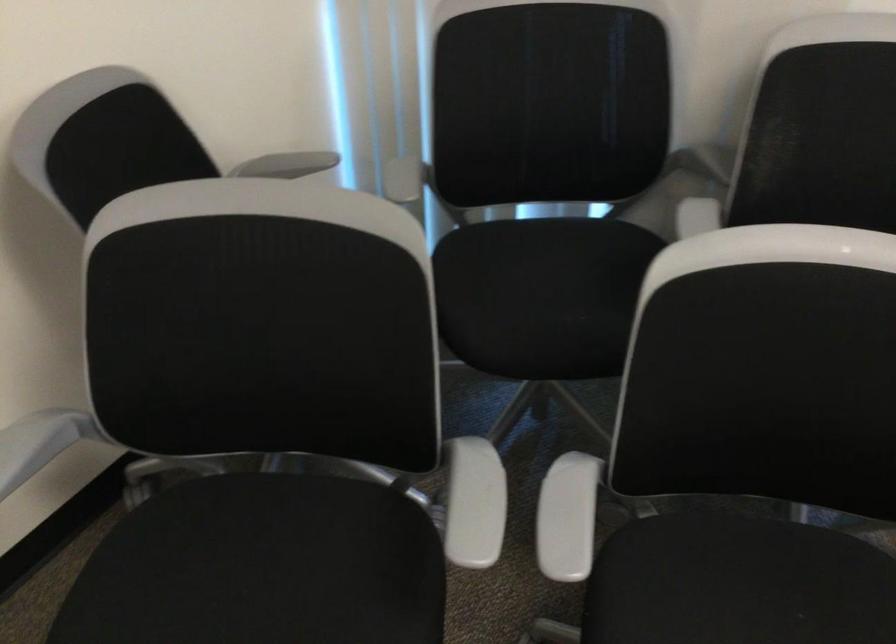
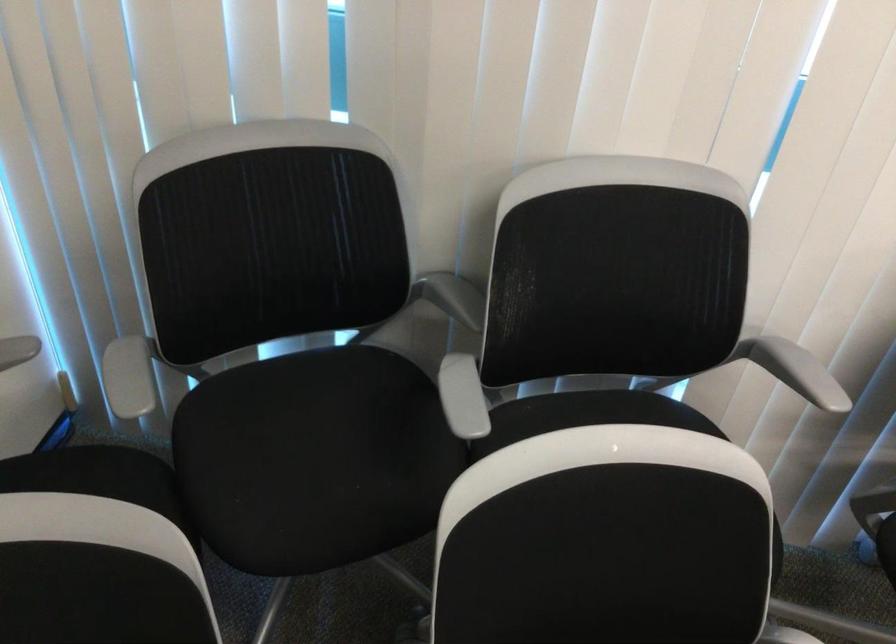
In the second image, find the point that corresponds to pixel 400 178 in the first image.

(131, 377)